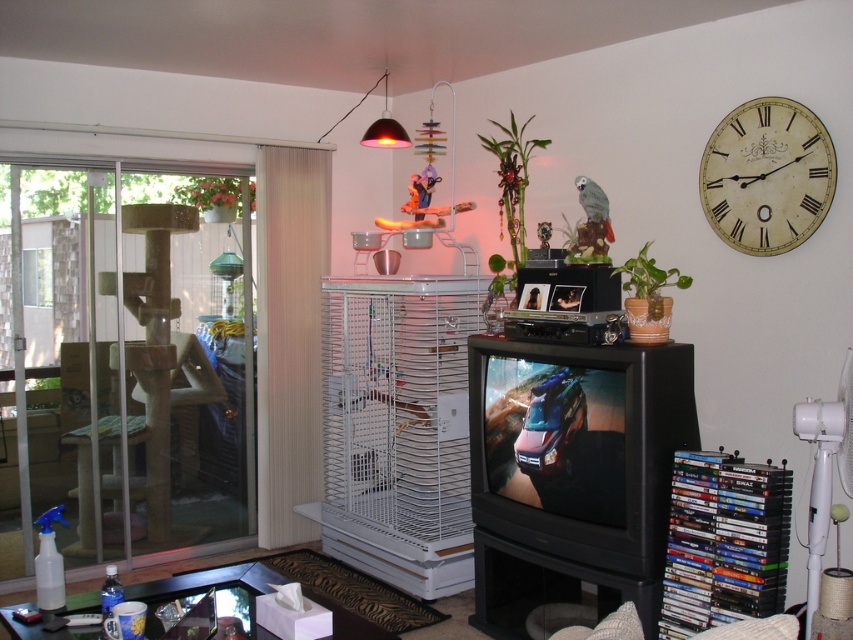
You are standing in the living room and want to place a new picture frame on the wall. The frame must be placed between the two points marked as point (18, 572) and point (808, 129). Which point should you place the frame closer to so that it appears closer to you?

You should place the frame closer to point (18, 572) because it is closer to the viewer than point (808, 129).

You are standing in the living room and want to go outside to the patio. The clear glass door at left is the exit. There is a point marked at coordinates (123, 358). Where is this point located?

The point marked at coordinates (123, 358) is on the clear glass door at left.